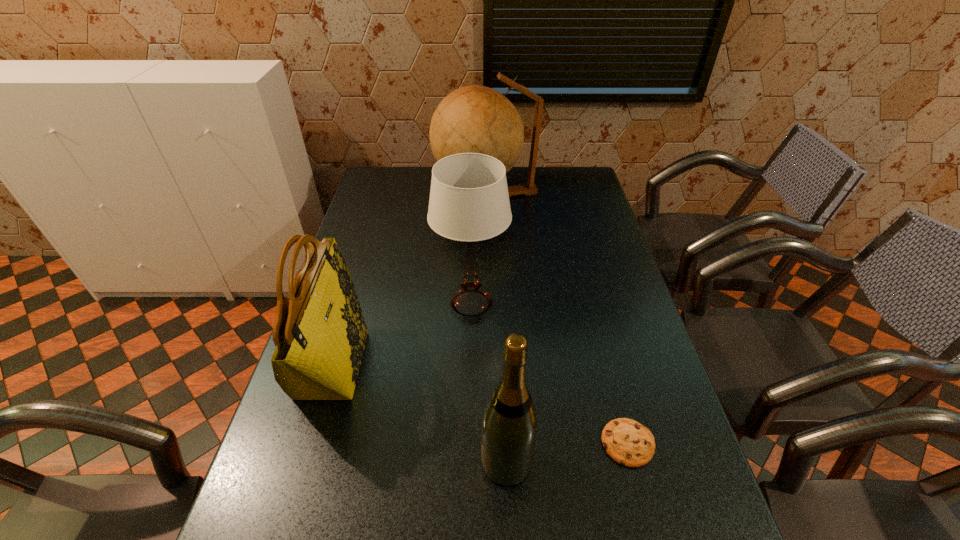
The image size is (960, 540). In order to click on object that stands as the fourth closest to the wine bottle in this screenshot , I will do `click(473, 119)`.

The image size is (960, 540). I want to click on the fourth closest object to the globe, so click(509, 427).

Where is `free location that satisfies the following two spatial constraints: 1. on the front-facing side of the table lamp; 2. on the left side of the shortest object`? The height and width of the screenshot is (540, 960). free location that satisfies the following two spatial constraints: 1. on the front-facing side of the table lamp; 2. on the left side of the shortest object is located at coordinates (468, 443).

This screenshot has height=540, width=960. What are the coordinates of `free point that satisfies the following two spatial constraints: 1. on the front-facing side of the table lamp; 2. on the right side of the cookie` in the screenshot? It's located at tap(468, 443).